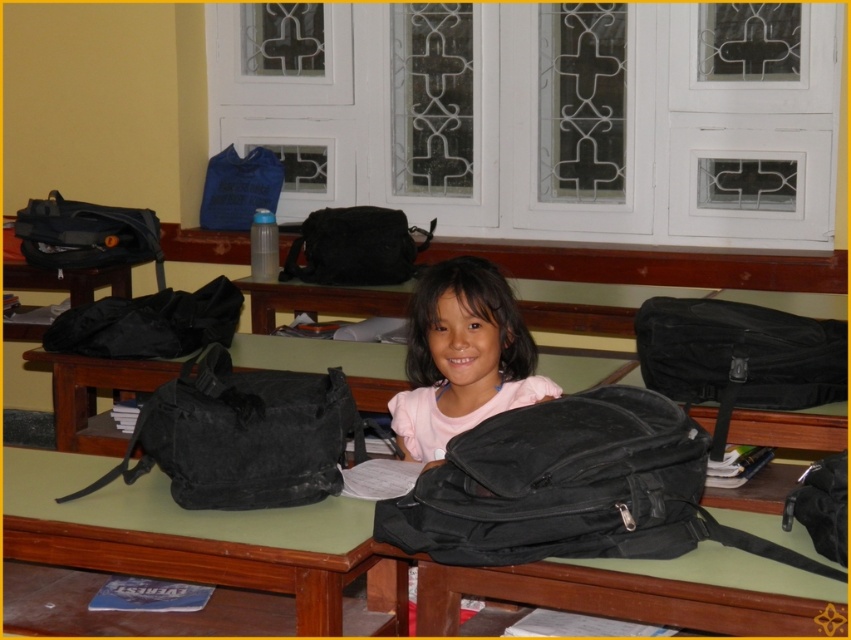
Is point (455, 369) less distant than point (307, 234)?

That is True.

Between pink matte backpack at center and matte black bag at center, which one is positioned lower?

pink matte backpack at center is lower down.

Who is more forward, (452, 316) or (349, 253)?

Point (452, 316) is more forward.

Locate an element on the screen. pink matte backpack at center is located at coordinates (461, 356).

Which of these two, black matte backpack at lower center or matte black bag at center, stands taller?

Standing taller between the two is matte black bag at center.

Which is in front, point (226, 564) or point (332, 230)?

Point (226, 564) is more forward.

Does point (198, 541) come closer to viewer compared to point (351, 260)?

Yes.

You are a GUI agent. You are given a task and a screenshot of the screen. Output one action in this format:
    pyautogui.click(x=<x>, y=<y>)
    Task: Click on the black matte backpack at lower center
    Image resolution: width=851 pixels, height=640 pixels.
    Given the screenshot: What is the action you would take?
    pyautogui.click(x=184, y=534)

Describe the element at coordinates (570, 486) in the screenshot. I see `black fabric backpack at center` at that location.

Consider the image. Is black fabric backpack at center shorter than black fabric bag at left?

No.

Locate an element on the screen. The width and height of the screenshot is (851, 640). black fabric backpack at center is located at coordinates (570, 486).

Where is `black fabric backpack at center`? black fabric backpack at center is located at coordinates (570, 486).